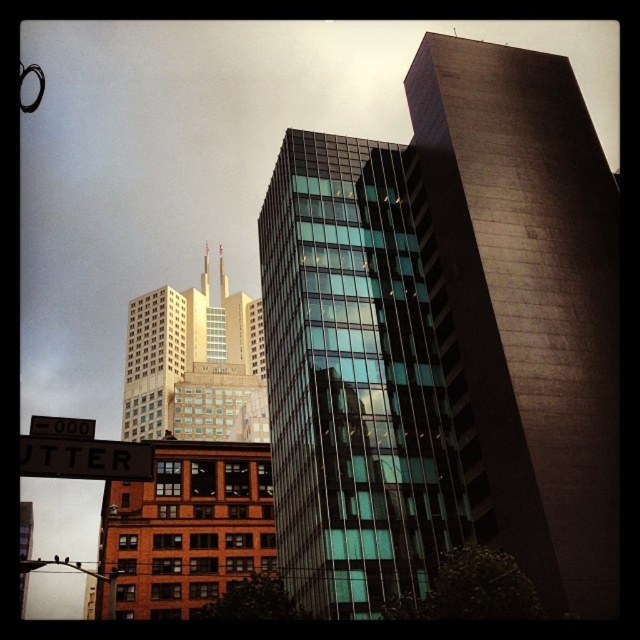
You are a city planner reviewing the layout of the cityscape. The glassy steel building at center is crucial for a new public transportation hub. Given its coordinates at point 0.530, 0.698, how does its position affect accessibility from the main roads in the area?

The glassy steel building at center is positioned at coordinates (445, 339), which places it centrally within the cityscape. This central location enhances accessibility from main roads, making it an ideal spot for a public transportation hub as it can be easily reached from multiple directions.

You are a delivery drone with a wingspan of 1.2 meters. You need to fly from the brown wooden street sign at lower left to the glassy steel building at center. Is there enough space between them for your drone to pass safely?

The glassy steel building at center is 33.40 meters away from the brown wooden street sign at lower left, so yes, the drone can safely pass between them as the distance is much greater than the drone wingspan of 1.2 meters.

Based on the scene description, what are the coordinates of the glassy steel building at center?

The glassy steel building at center is located at coordinates point (445,339).